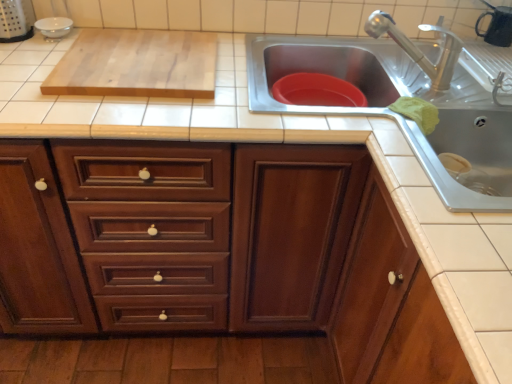
Question: Considering the positions of wooden cabinet at center, placed as the 2th cabinetry when sorted from right to left, and light wood cutting board at upper left in the image, is wooden cabinet at center, placed as the 2th cabinetry when sorted from right to left, bigger or smaller than light wood cutting board at upper left?

Choices:
 (A) big
 (B) small

Answer: (A)

Question: From the image's perspective, is wooden cabinet at center, placed as the 2th cabinetry when sorted from right to left, positioned above or below light wood cutting board at upper left?

Choices:
 (A) below
 (B) above

Answer: (A)

Question: Estimate the real-world distances between objects in this image. Which object is farther from the wooden cabinet at lower right, the 2th cabinetry viewed from the left?

Choices:
 (A) stainless steel sink at upper right
 (B) light wood cutting board at upper left
 (C) wooden cabinet at center, placed as the 2th cabinetry when sorted from right to left

Answer: (B)

Question: Estimate the real-world distances between objects in this image. Which object is farther from the light wood cutting board at upper left?

Choices:
 (A) wooden cabinet at lower right, which ranks as the 1th cabinetry in right-to-left order
 (B) stainless steel sink at upper right
 (C) wooden cabinet at center, placed as the 2th cabinetry when sorted from right to left

Answer: (A)